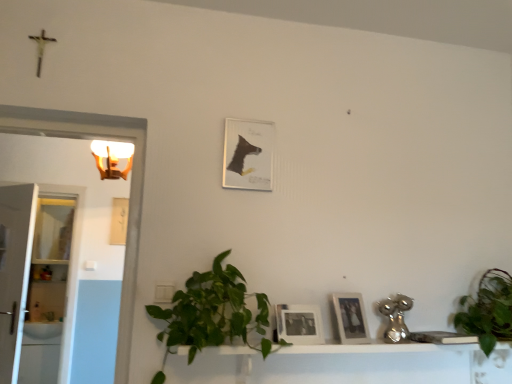
Question: Is matte paper picture frame at center, the first picture frame when ordered from top to bottom, aimed at white glossy sink at left?

Choices:
 (A) yes
 (B) no

Answer: (B)

Question: Can you confirm if matte paper picture frame at center, the 2th picture frame from the back, is wider than white glossy sink at left?

Choices:
 (A) no
 (B) yes

Answer: (A)

Question: From a real-world perspective, is matte paper picture frame at center, the 2th picture frame from the back, physically below white glossy sink at left?

Choices:
 (A) yes
 (B) no

Answer: (B)

Question: Is matte paper picture frame at center, the first picture frame when ordered from top to bottom, positioned before white glossy sink at left?

Choices:
 (A) yes
 (B) no

Answer: (A)

Question: Considering the relative sizes of matte paper picture frame at center, the 3th picture frame positioned from the front, and white glossy sink at left in the image provided, is matte paper picture frame at center, the 3th picture frame positioned from the front, bigger than white glossy sink at left?

Choices:
 (A) yes
 (B) no

Answer: (B)

Question: Is matte paper picture frame at center, the 3th picture frame positioned from the front, positioned behind white glossy sink at left?

Choices:
 (A) no
 (B) yes

Answer: (A)

Question: Is white glossy sink at left oriented towards matte paper picture frame at center, the 3th picture frame positioned from the front?

Choices:
 (A) yes
 (B) no

Answer: (B)

Question: Can you confirm if white glossy sink at left is smaller than matte paper picture frame at center, the fourth picture frame when ordered from bottom to top?

Choices:
 (A) yes
 (B) no

Answer: (B)

Question: From a real-world perspective, is white glossy sink at left beneath matte paper picture frame at center, arranged as the second picture frame when viewed from the left?

Choices:
 (A) no
 (B) yes

Answer: (B)

Question: Are white glossy sink at left and matte paper picture frame at center, the first picture frame when ordered from top to bottom, located far from each other?

Choices:
 (A) yes
 (B) no

Answer: (A)

Question: From the image's perspective, is white glossy sink at left over matte paper picture frame at center, the 2th picture frame from the back?

Choices:
 (A) no
 (B) yes

Answer: (A)

Question: Is white glossy sink at left directly adjacent to matte paper picture frame at center, arranged as the second picture frame when viewed from the left?

Choices:
 (A) no
 (B) yes

Answer: (A)

Question: Considering the relative positions of matte black photo frame at center, which is counted as the second picture frame, starting from the right, and white glossy light fixture at upper left in the image provided, is matte black photo frame at center, which is counted as the second picture frame, starting from the right, to the right of white glossy light fixture at upper left from the viewer's perspective?

Choices:
 (A) no
 (B) yes

Answer: (B)